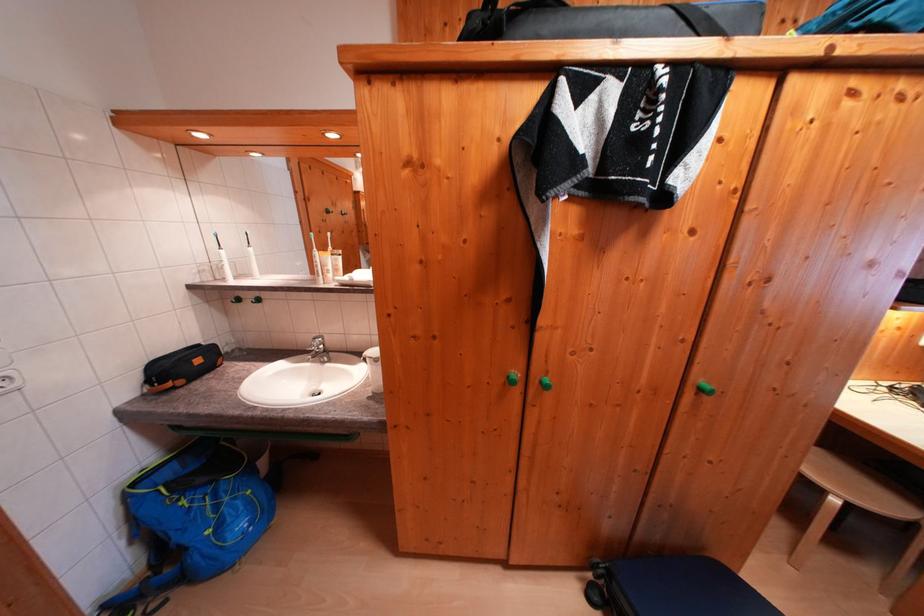
Find the location of `stool sitting surface`. stool sitting surface is located at coordinates (886, 485).